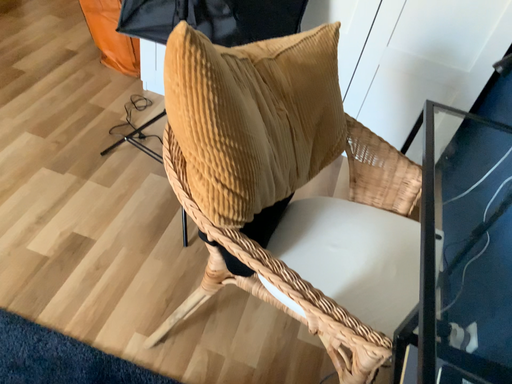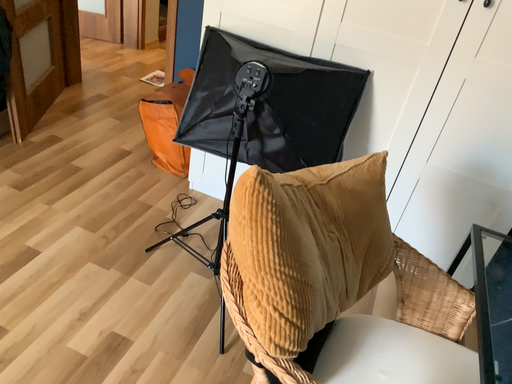
Question: Which way did the camera rotate in the video?

Choices:
 (A) rotated downward
 (B) rotated upward

Answer: (B)